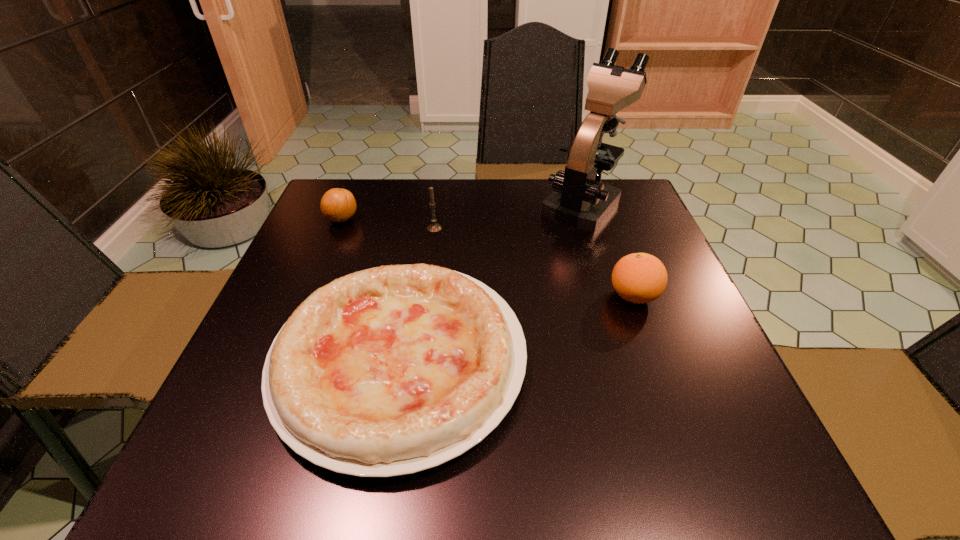
Where is `vacant space situated on the front of the shorter orange`? The height and width of the screenshot is (540, 960). vacant space situated on the front of the shorter orange is located at coordinates (300, 324).

This screenshot has width=960, height=540. I want to click on vacant position located on the back of the pizza, so click(427, 197).

The width and height of the screenshot is (960, 540). In order to click on microscope at the far edge in this screenshot , I will do `click(580, 200)`.

At what (x,y) coordinates should I click in order to perform the action: click on candle that is positioned at the far edge. Please return your answer as a coordinate pair (x, y). The width and height of the screenshot is (960, 540). Looking at the image, I should click on (x=433, y=227).

Identify the location of orange present at the far edge. (338, 205).

The height and width of the screenshot is (540, 960). In order to click on object that is positioned at the near edge in this screenshot , I will do `click(392, 370)`.

At what (x,y) coordinates should I click in order to perform the action: click on orange positioned at the left edge. Please return your answer as a coordinate pair (x, y). Looking at the image, I should click on (338, 205).

This screenshot has height=540, width=960. I want to click on pizza that is at the left edge, so click(x=392, y=370).

In order to click on microscope at the right edge in this screenshot , I will do `click(580, 200)`.

In order to click on orange present at the right edge in this screenshot , I will do `click(639, 278)`.